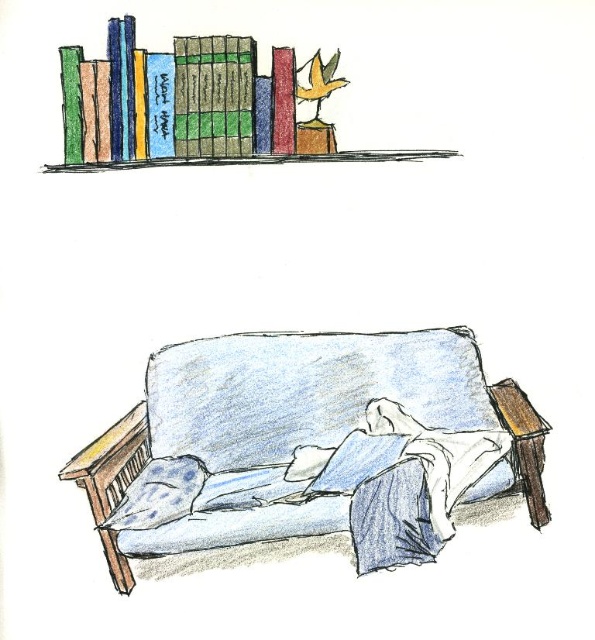
Question: Which object is the closest to the blue fabric pillow at center?

Choices:
 (A) matte green book at upper left
 (B) blue dotted pillow at lower left

Answer: (B)

Question: Is matte green book at upper left to the right of blue fabric pillow at center from the viewer's perspective?

Choices:
 (A) no
 (B) yes

Answer: (A)

Question: Is blue fabric couch at center to the right of orange matte bird at upper center from the viewer's perspective?

Choices:
 (A) no
 (B) yes

Answer: (A)

Question: Estimate the real-world distances between objects in this image. Which object is closer to the blue fabric pillow at center?

Choices:
 (A) blue fabric couch at center
 (B) matte green book at upper left

Answer: (A)

Question: Does blue fabric couch at center appear on the right side of orange matte bird at upper center?

Choices:
 (A) no
 (B) yes

Answer: (A)

Question: Which point is farther to the camera?

Choices:
 (A) matte green book at upper left
 (B) orange matte bird at upper center
 (C) blue dotted pillow at lower left

Answer: (B)